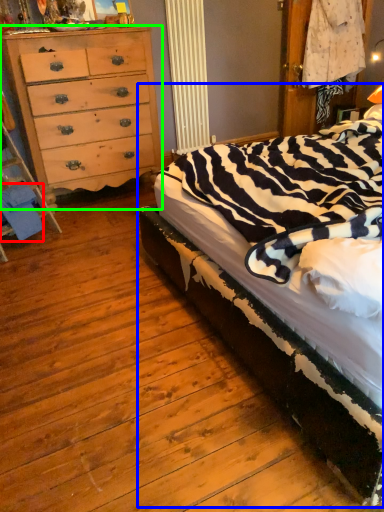
Question: Which object is the farthest from material (highlighted by a red box)? Choose among these: bed (highlighted by a blue box) or chest of drawers (highlighted by a green box).

Choices:
 (A) bed
 (B) chest of drawers

Answer: (A)